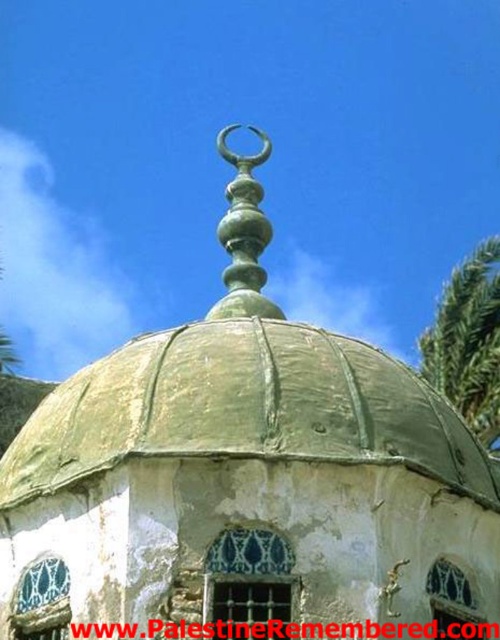
You are standing in front of the mosque and want to take a photo that includes both the green leafy palm tree at right and the green polished metal spire at center. Which object should you position to your left side in the frame to ensure both are visible?

You should position the green polished metal spire at center to your left side in the frame because the green leafy palm tree at right is located to the right of it, so placing the spire on your left will allow both to be included in the photo.

Based on the photo, you are an architect designing a new mosque. You want to ensure that the green leafy palm tree at right and the green polished metal spire at center are visible from the main entrance. Given their widths, which object might require strategic placement to avoid blocking the view of the other?

The green leafy palm tree at right has a larger width than the green polished metal spire at center, so it might need to be placed further back or trimmed to ensure both are visible without obstruction.

You are standing in front of the mosque dome and want to determine the relative positions of two points on the dome and wall structure. The first point is at coordinates point (470, 320), and the second is at point (266, 273). Which point is closer to your eyes?

Point (266, 273) is closer to your eyes because it is less further to the camera than point (470, 320).